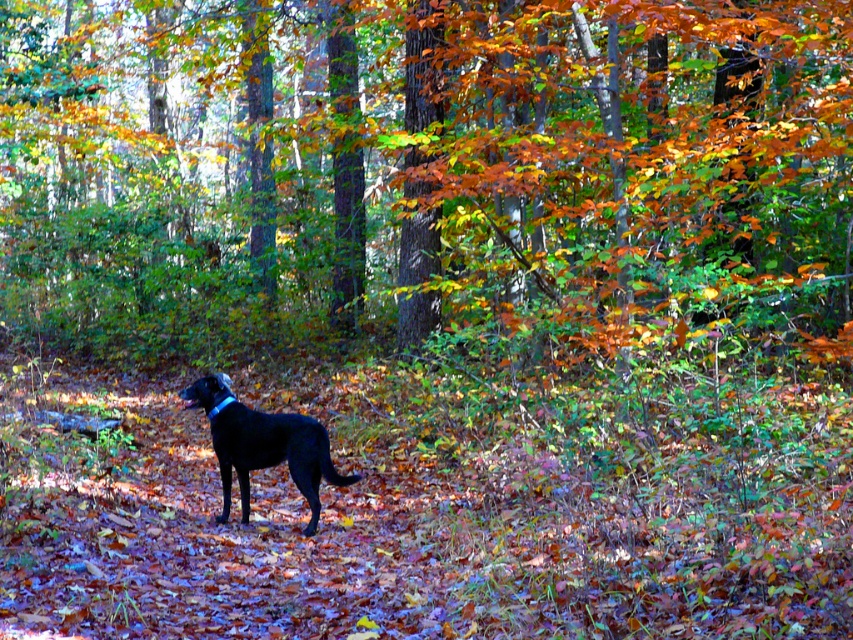
You are a hiker who wants to take a photo of the shiny black dog at center and the blue fabric neckband at center. To ensure both are in frame, do you need to adjust your camera angle to focus on the wider object?

The shiny black dog at center might be wider than blue fabric neckband at center, so you should focus on the shiny black dog at center to ensure both are in frame.

You are standing in the autumn forest and see the shiny black dog at center and the blue fabric neckband at center. Which object is nearer to you?

The shiny black dog at center is closer to the viewer than the blue fabric neckband at center.

You are a hiker who wants to take a photo of the shiny black dog at center and the blue fabric neckband at center. How far apart are these two items in inches?

The shiny black dog at center is 13.28 inches from blue fabric neckband at center, so the distance between them is 13.28 inches.